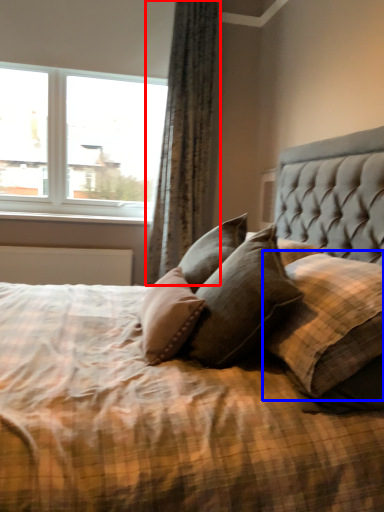
Question: Which of the following is the closest to the observer, curtain (highlighted by a red box) or pillow (highlighted by a blue box)?

Choices:
 (A) curtain
 (B) pillow

Answer: (B)